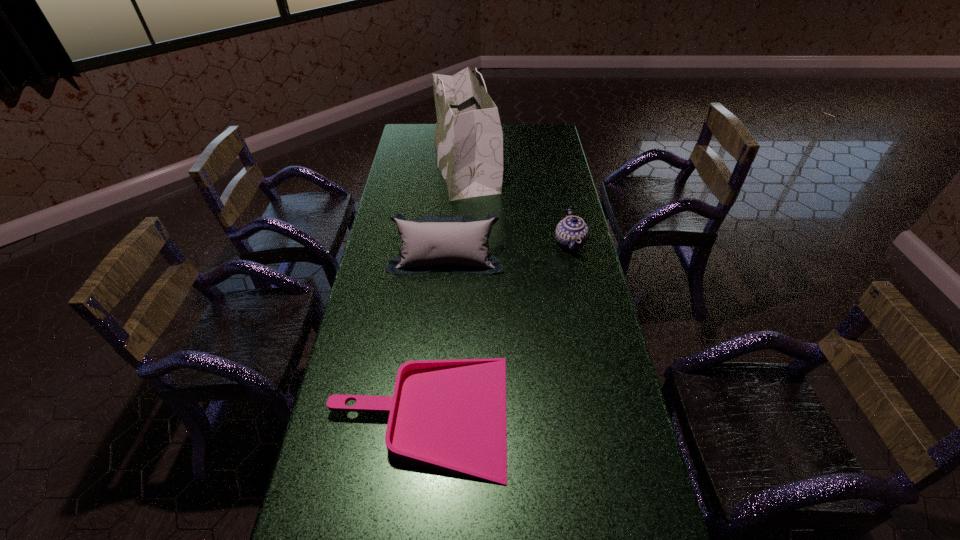
Locate an element on the screen. The image size is (960, 540). free space located 0.230m at the spout of the second shortest object is located at coordinates (493, 244).

You are a GUI agent. You are given a task and a screenshot of the screen. Output one action in this format:
    pyautogui.click(x=<x>, y=<y>)
    Task: Click on the free location located 0.320m at the spout of the second shortest object
    The width and height of the screenshot is (960, 540).
    Given the screenshot: What is the action you would take?
    pyautogui.click(x=470, y=244)

Identify the location of object that is at the far edge. The image size is (960, 540). (469, 140).

Locate an element on the screen. cushion that is at the left edge is located at coordinates (455, 243).

The height and width of the screenshot is (540, 960). What are the coordinates of `dustpan present at the left edge` in the screenshot? It's located at (x=449, y=415).

Identify the location of object that is at the right edge. The image size is (960, 540). 570,230.

Identify the location of free space at the left edge of the desktop. The height and width of the screenshot is (540, 960). (363, 414).

In the image, there is a desktop. At what (x,y) coordinates should I click in order to perform the action: click on vacant region at the right edge. Please return your answer as a coordinate pair (x, y). The image size is (960, 540). Looking at the image, I should click on (549, 177).

The image size is (960, 540). I want to click on vacant space at the far left corner, so click(416, 132).

Identify the location of free space between the rightmost object and the grocery bag. (517, 204).